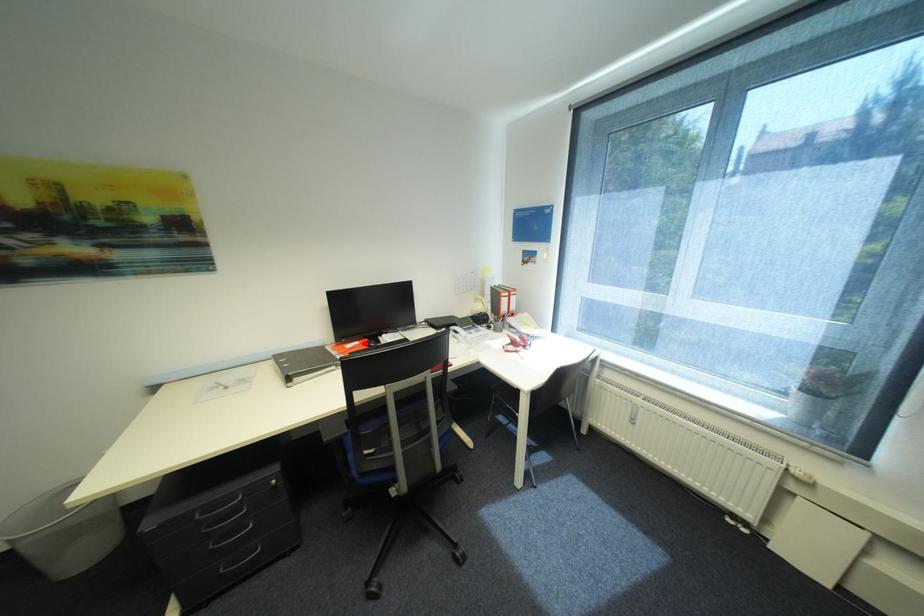
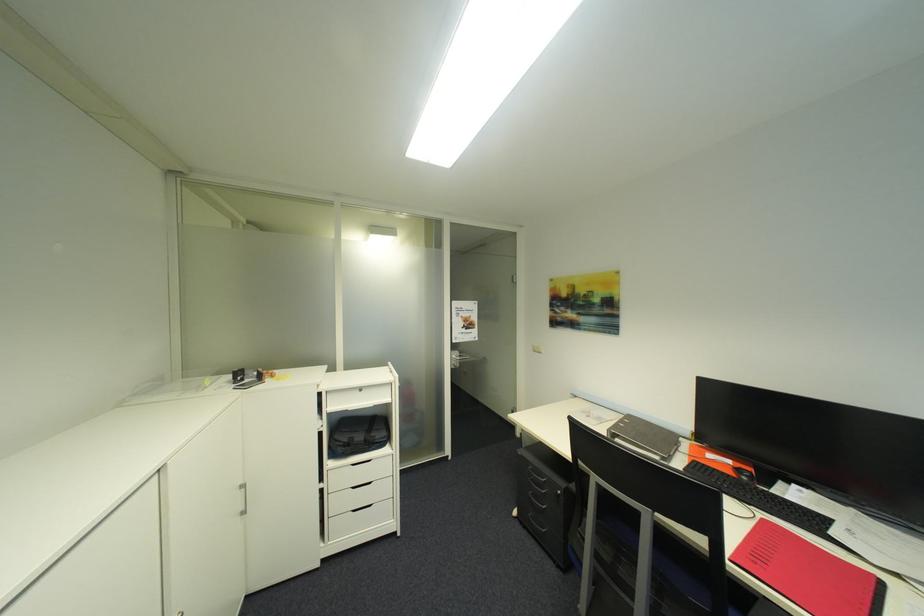
In the second image, find the point that corresponds to the highlighted location in the first image.

(736, 463)